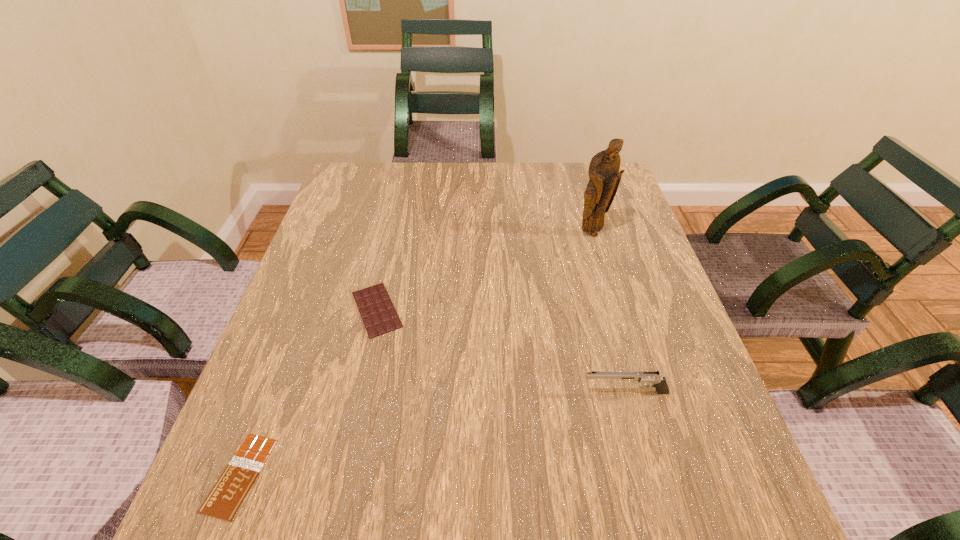
You are a GUI agent. You are given a task and a screenshot of the screen. Output one action in this format:
    pyautogui.click(x=<x>, y=<y>)
    Task: Click on the vacant area situated on the front-facing side of the pistol
    The height and width of the screenshot is (540, 960).
    Given the screenshot: What is the action you would take?
    pyautogui.click(x=377, y=393)

Where is `vacant area situated 0.140m on the front-facing side of the pistol`? Image resolution: width=960 pixels, height=540 pixels. vacant area situated 0.140m on the front-facing side of the pistol is located at coordinates (508, 393).

Identify the location of vacant region located 0.310m on the back of the second shortest object. (399, 208).

I want to click on vacant region located on the right of the nearer chocolate bar, so click(375, 475).

Locate an element on the screen. object positioned at the near edge is located at coordinates (224, 500).

At what (x,y) coordinates should I click in order to perform the action: click on figurine positioned at the right edge. Please return your answer as a coordinate pair (x, y). The width and height of the screenshot is (960, 540). Looking at the image, I should click on (604, 174).

I want to click on pistol that is at the right edge, so click(659, 382).

What are the coordinates of `object at the near left corner` in the screenshot? It's located at (224, 500).

Identify the location of free region at the far edge. The height and width of the screenshot is (540, 960). (434, 183).

In the image, there is a desktop. Where is `vacant space at the near edge`? The image size is (960, 540). vacant space at the near edge is located at coordinates (451, 526).